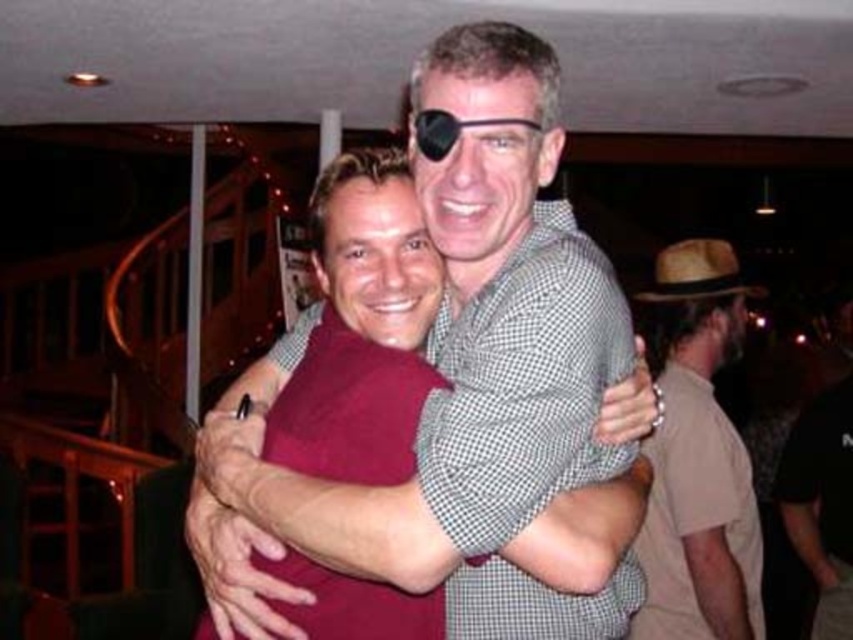
Question: Can you confirm if brown straw hat at right is thinner than brown straw cowboy hat at right?

Choices:
 (A) yes
 (B) no

Answer: (B)

Question: Which of the following is the farthest from the observer?

Choices:
 (A) (656, 468)
 (B) (672, 266)
 (C) (490, 467)

Answer: (B)

Question: Is maroon shirt at center bigger than brown straw cowboy hat at right?

Choices:
 (A) no
 (B) yes

Answer: (B)

Question: Is brown straw hat at right positioned before brown straw cowboy hat at right?

Choices:
 (A) yes
 (B) no

Answer: (A)

Question: Which object is positioned closest to the maroon shirt at center?

Choices:
 (A) brown straw cowboy hat at right
 (B) brown straw hat at right

Answer: (B)

Question: Among these objects, which one is nearest to the camera?

Choices:
 (A) brown straw cowboy hat at right
 (B) brown straw hat at right
 (C) maroon shirt at center

Answer: (C)